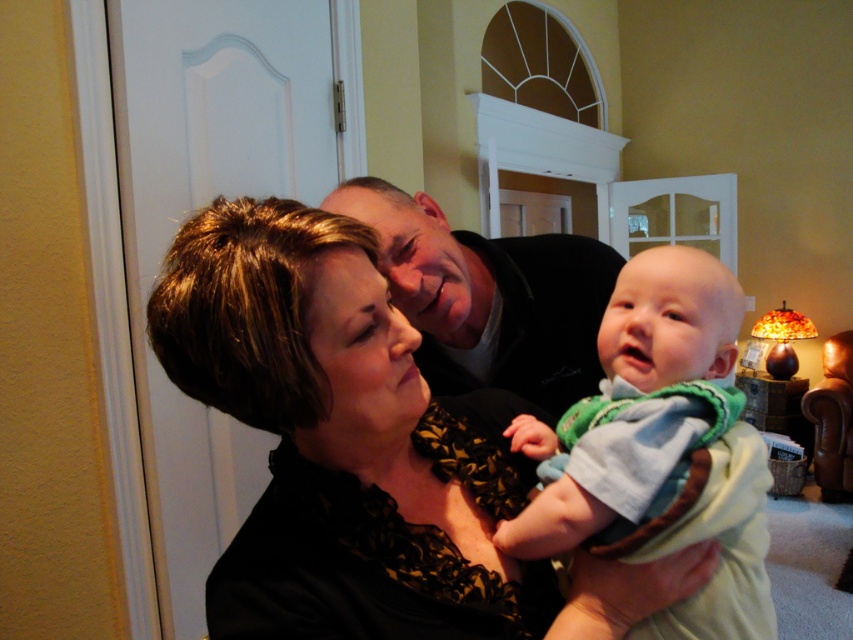
Between point (440, 472) and point (698, 257), which one is positioned behind?

The point (698, 257) is behind.

Who is more distant from viewer, (x=250, y=628) or (x=631, y=316)?

Positioned behind is point (x=631, y=316).

The height and width of the screenshot is (640, 853). I want to click on black lace blouse at center, so click(357, 449).

Between smooth black shirt at center and soft green knit sweater at center, which one has more height?

With more height is smooth black shirt at center.

Which is behind, point (509, 275) or point (519, 513)?

The point (509, 275) is more distant.

This screenshot has width=853, height=640. What do you see at coordinates (488, 298) in the screenshot?
I see `smooth black shirt at center` at bounding box center [488, 298].

Locate an element on the screen. smooth black shirt at center is located at coordinates (488, 298).

Does point (216, 349) come behind point (532, 284)?

No, (216, 349) is in front of (532, 284).

Describe the element at coordinates (357, 449) in the screenshot. I see `black lace blouse at center` at that location.

Find the location of a particular element. This screenshot has width=853, height=640. black lace blouse at center is located at coordinates (357, 449).